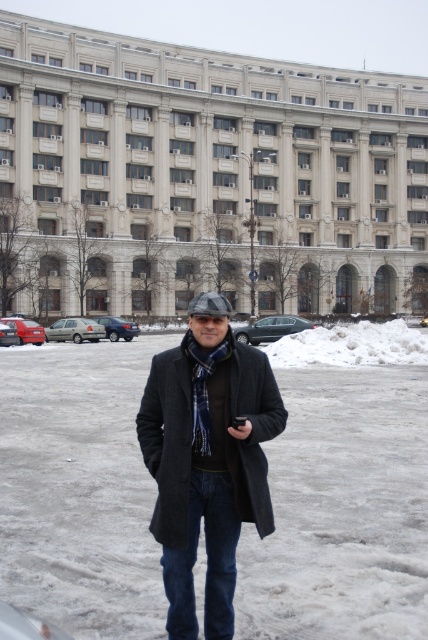
Can you confirm if white fluffy snow at lower right is positioned to the right of sleek black sedan at center?

Indeed, white fluffy snow at lower right is positioned on the right side of sleek black sedan at center.

Does point (348, 333) come closer to viewer compared to point (273, 324)?

That is True.

Find the location of a particular element. The height and width of the screenshot is (640, 428). white fluffy snow at lower right is located at coordinates (350, 346).

Where is `white fluffy snow at lower right`? white fluffy snow at lower right is located at coordinates (350, 346).

Does white fluffy snow at center appear under blue plaid scarf at center?

Correct, white fluffy snow at center is located below blue plaid scarf at center.

Does white fluffy snow at center have a greater width compared to blue plaid scarf at center?

Yes, white fluffy snow at center is wider than blue plaid scarf at center.

Between point (5, 548) and point (226, 353), which one is positioned behind?

Point (5, 548)

Where is `white fluffy snow at center`? Image resolution: width=428 pixels, height=640 pixels. white fluffy snow at center is located at coordinates (341, 509).

Who is positioned more to the right, white fluffy snow at center or matte red car at lower left?

Positioned to the right is white fluffy snow at center.

Measure the distance between white fluffy snow at center and matte red car at lower left.

54.37 feet

Which is behind, point (282, 512) or point (38, 332)?

The point (38, 332) is more distant.

Locate an element on the screen. The image size is (428, 640). white fluffy snow at center is located at coordinates (341, 509).